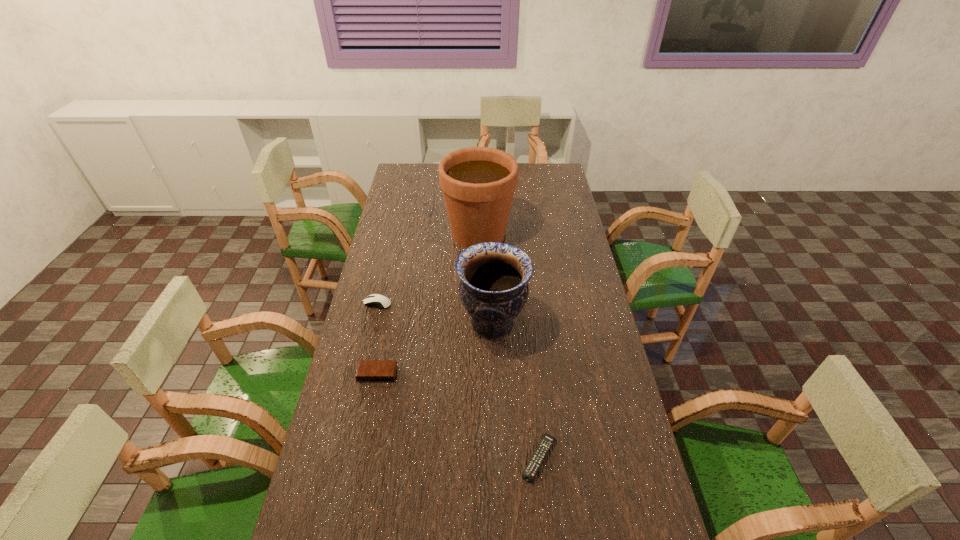
Locate an element on the screen. The image size is (960, 540). vacant region located 0.290m on the front handle of the fourth shortest object is located at coordinates (375, 323).

You are a GUI agent. You are given a task and a screenshot of the screen. Output one action in this format:
    pyautogui.click(x=<x>, y=<y>)
    Task: Click on the free space located on the front handle of the fourth shortest object
    The image size is (960, 540).
    Given the screenshot: What is the action you would take?
    pyautogui.click(x=393, y=323)

Image resolution: width=960 pixels, height=540 pixels. Identify the location of free location located 0.250m on the right of the third shortest object. (460, 303).

Locate an element on the screen. blank area located 0.100m on the front face of the fourth tallest object is located at coordinates (370, 411).

In order to click on free space located on the front of the nearest object in this screenshot , I will do `click(547, 539)`.

Where is `mouse that is at the left edge`? The height and width of the screenshot is (540, 960). mouse that is at the left edge is located at coordinates (375, 300).

This screenshot has width=960, height=540. In order to click on alarm clock that is positioned at the left edge in this screenshot , I will do `click(368, 370)`.

Find the location of a particular element. This screenshot has width=960, height=540. free space at the far edge of the desktop is located at coordinates (426, 187).

Find the location of a particular element. The height and width of the screenshot is (540, 960). vacant space at the left edge of the desktop is located at coordinates (383, 281).

Find the location of a particular element. The image size is (960, 540). empty location between the fourth shortest object and the mouse is located at coordinates (435, 313).